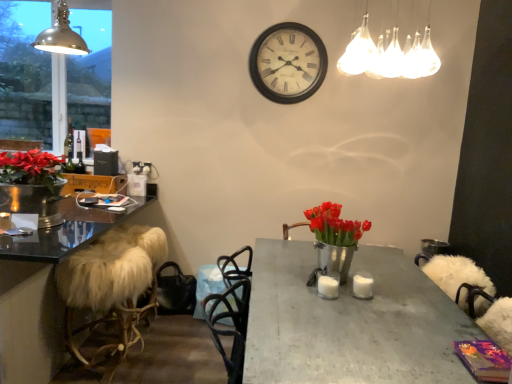
What are the coordinates of `free space to the left of white matte candle at center, which is the 2th candle from right to left` in the screenshot? It's located at (300, 289).